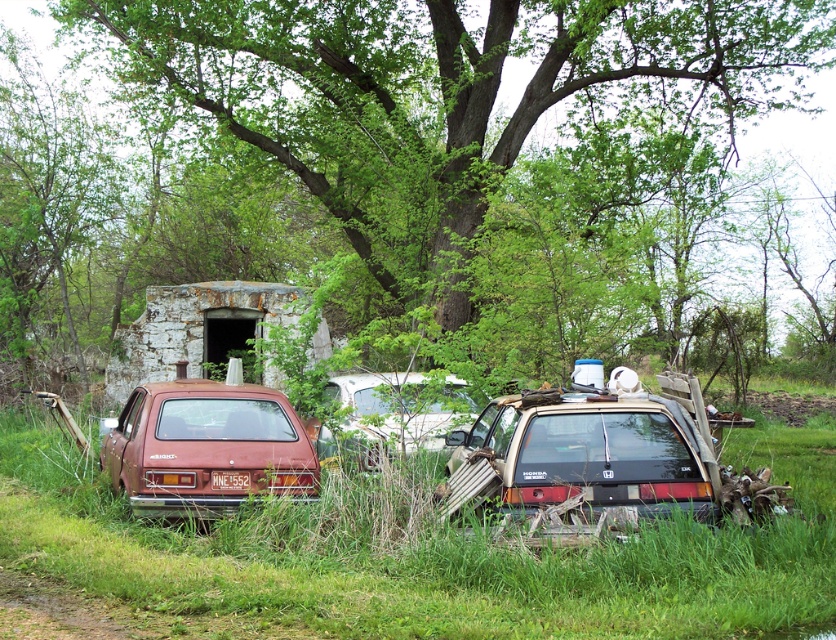
You are a photographer trying to capture the rusty metal suv at center and the rusty metal station wagon at lower left. Which vehicle is located above the other in the image?

The rusty metal suv at center is positioned under the rusty metal station wagon at lower left, so the rusty metal station wagon at lower left is above the rusty metal suv at center.

You are a photographer wanting to capture both the rusty metal station wagon at lower left and the white matte car at center in a single frame. Considering their heights, which vehicle should be placed closer to the camera to ensure both are fully visible in the photo?

The rusty metal station wagon at lower left is much taller than the white matte car at center. To ensure both are fully visible in the photo, the taller vehicle, the rusty metal station wagon at lower left, should be placed closer to the camera so that its height doesn not block the view of the shorter white matte car at center.

You are a gardener trying to mow the lawn in the image. You see the green grass at center and the white matte car at center. Which area should you avoid mowing to prevent damaging the car?

Result: You should avoid mowing near the white matte car at center because the green grass at center is larger in size than the white matte car at center, indicating the car is smaller and possibly closer to the grass area.